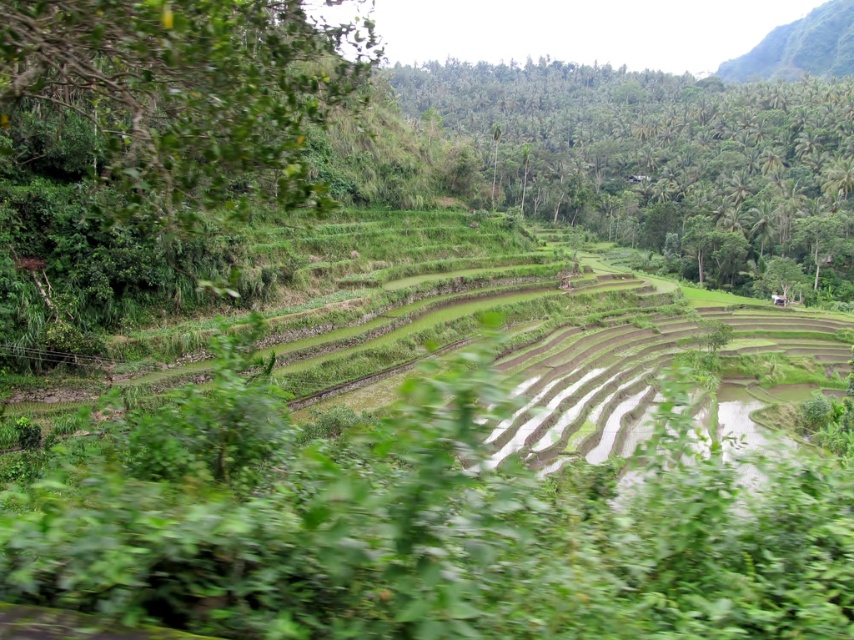
Who is shorter, green leafy trees at upper center or green leafy hillside at upper right?

green leafy hillside at upper right

Who is positioned more to the left, green leafy trees at upper center or green leafy hillside at upper right?

Positioned to the left is green leafy trees at upper center.

Does point (642, 214) come farther from viewer compared to point (788, 61)?

No, it is in front of (788, 61).

Identify the location of green leafy trees at upper center. (664, 160).

Is green leafy tree at left to the left of green leafy hillside at upper right from the viewer's perspective?

Yes, green leafy tree at left is to the left of green leafy hillside at upper right.

Where is `green leafy tree at left`? Image resolution: width=854 pixels, height=640 pixels. green leafy tree at left is located at coordinates (188, 93).

Is green leafy trees at upper center to the right of green leafy tree at left from the viewer's perspective?

Correct, you'll find green leafy trees at upper center to the right of green leafy tree at left.

Can you confirm if green leafy trees at upper center is taller than green leafy tree at left?

Yes, green leafy trees at upper center is taller than green leafy tree at left.

Does point (808, 272) come closer to viewer compared to point (151, 141)?

No.

This screenshot has width=854, height=640. Find the location of `green leafy trees at upper center`. green leafy trees at upper center is located at coordinates (664, 160).